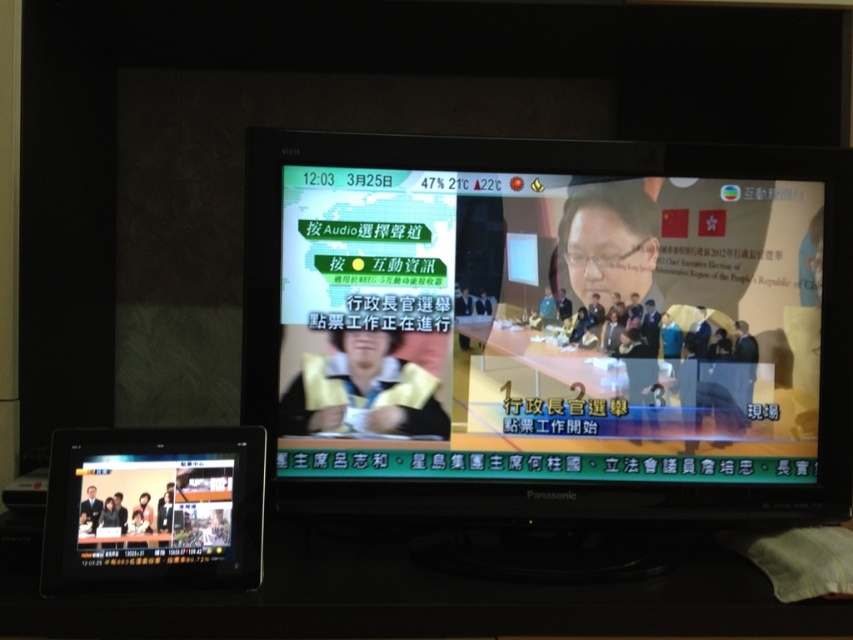
Does matte black monitor at center have a greater width compared to black glossy tablet at lower left?

Indeed, matte black monitor at center has a greater width compared to black glossy tablet at lower left.

Does point (816, 184) come closer to viewer compared to point (50, 584)?

No, it is not.

The width and height of the screenshot is (853, 640). I want to click on matte black monitor at center, so click(549, 326).

Where is `matte black monitor at center`? matte black monitor at center is located at coordinates (549, 326).